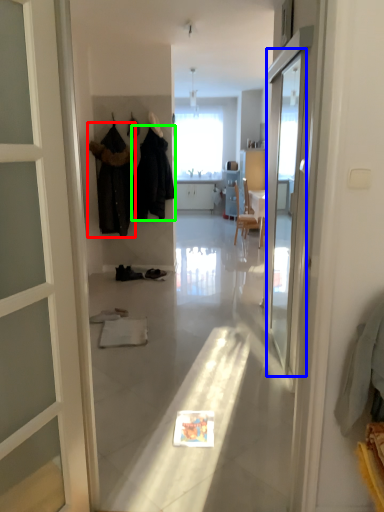
Question: Based on their relative distances, which object is farther from clothing (highlighted by a red box)? Choose from screen door (highlighted by a blue box) and clothing (highlighted by a green box).

Choices:
 (A) screen door
 (B) clothing

Answer: (A)